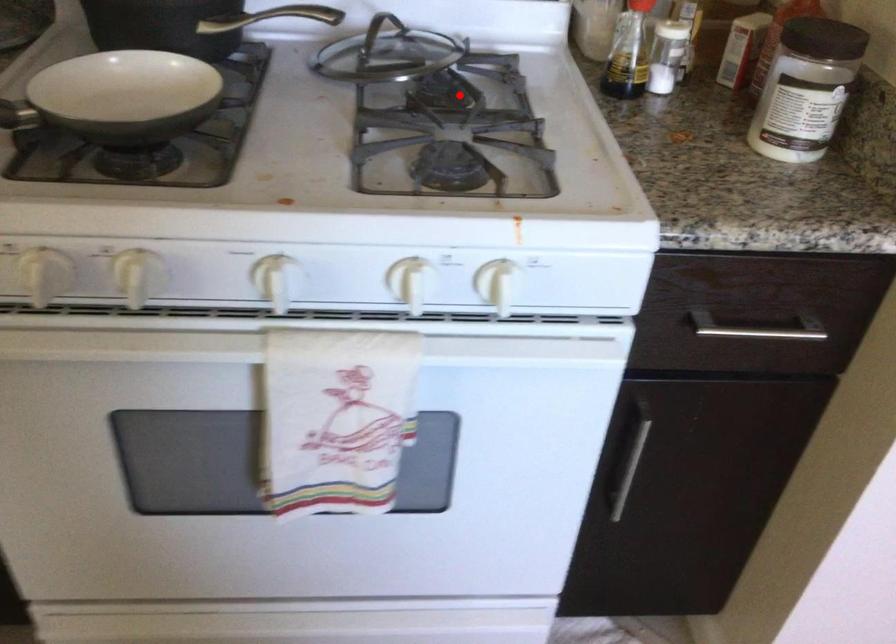
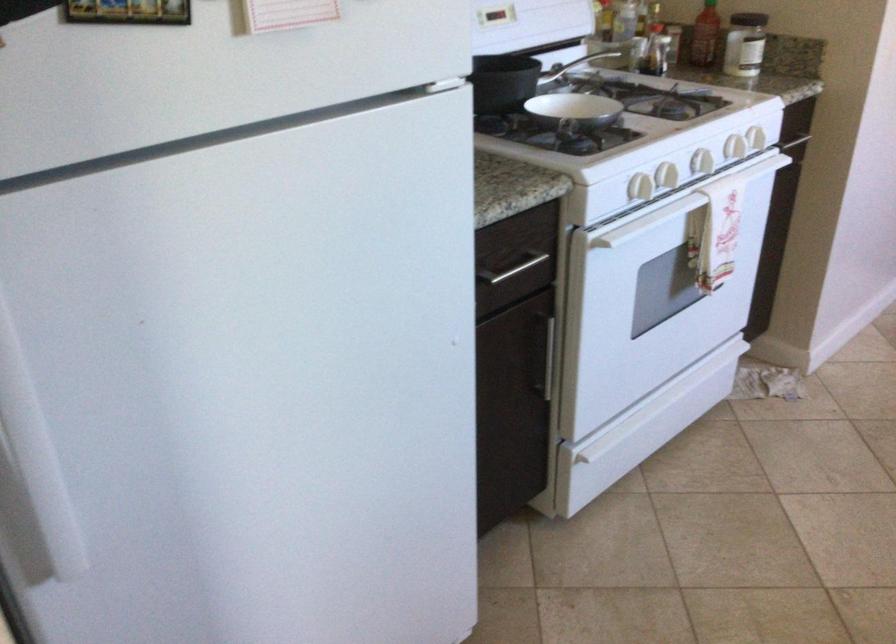
The point at the highlighted location is marked in the first image. Where is the corresponding point in the second image?

(574, 64)